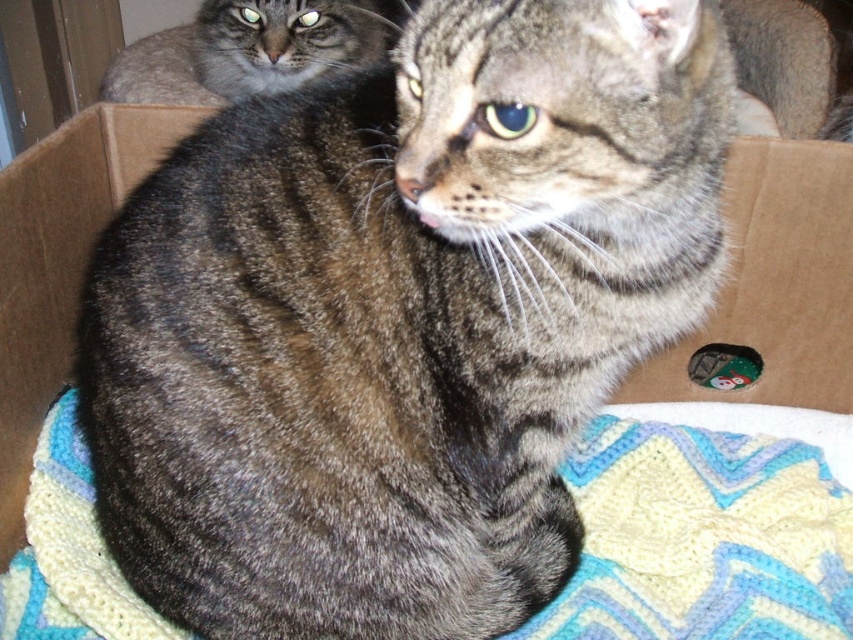
Question: Which point is closer to the camera?

Choices:
 (A) brown cardboard box at upper left
 (B) tabby fur cat at upper left
 (C) brown cardboard box at center

Answer: (A)

Question: From the image, what is the correct spatial relationship of brown cardboard box at center in relation to tabby fur cat at upper left?

Choices:
 (A) left
 (B) right

Answer: (B)

Question: Can you confirm if brown cardboard box at center is positioned below tabby fur cat at upper left?

Choices:
 (A) yes
 (B) no

Answer: (A)

Question: Does brown cardboard box at center have a lesser width compared to brown cardboard box at upper left?

Choices:
 (A) yes
 (B) no

Answer: (B)

Question: Based on their relative distances, which object is farther from the brown cardboard box at upper left?

Choices:
 (A) tabby fur cat at upper left
 (B) brown cardboard box at center

Answer: (B)

Question: Considering the real-world distances, which object is farthest from the tabby fur cat at upper left?

Choices:
 (A) brown cardboard box at center
 (B) brown cardboard box at upper left

Answer: (A)